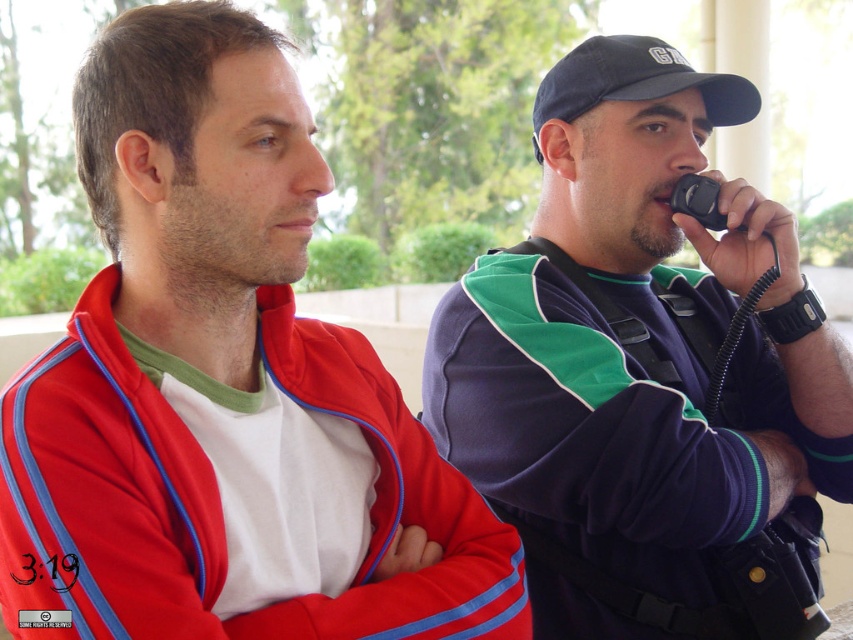
You are a photographer trying to capture a candid shot of the two people in the scene. You notice the black fabric baseball cap at upper right and the black plastic phone at right. Which object should you avoid blocking to ensure the subject remains visible?

You should avoid blocking the black fabric baseball cap at upper right because it is much taller than the black plastic phone at right, so it is more likely to obstruct the view of the subjects.

You are standing at the position of the viewer in the image. You want to hand the black fabric baseball cap at upper right to someone who is 1.7 meters tall. Can the person reach it without moving the cap?

The black fabric baseball cap at upper right is 2.95 meters away from the viewer. Since the person is 1.7 meters tall, they would need to stretch or use a tool to reach it as the distance exceeds their typical reach.